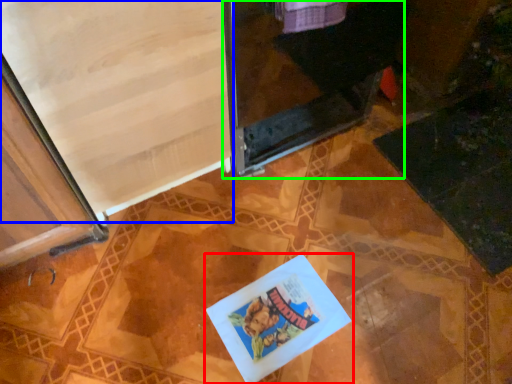
Question: Considering the real-world distances, which object is farthest from book (highlighted by a red box)? screen door (highlighted by a blue box) or screen door (highlighted by a green box)?

Choices:
 (A) screen door
 (B) screen door

Answer: (B)